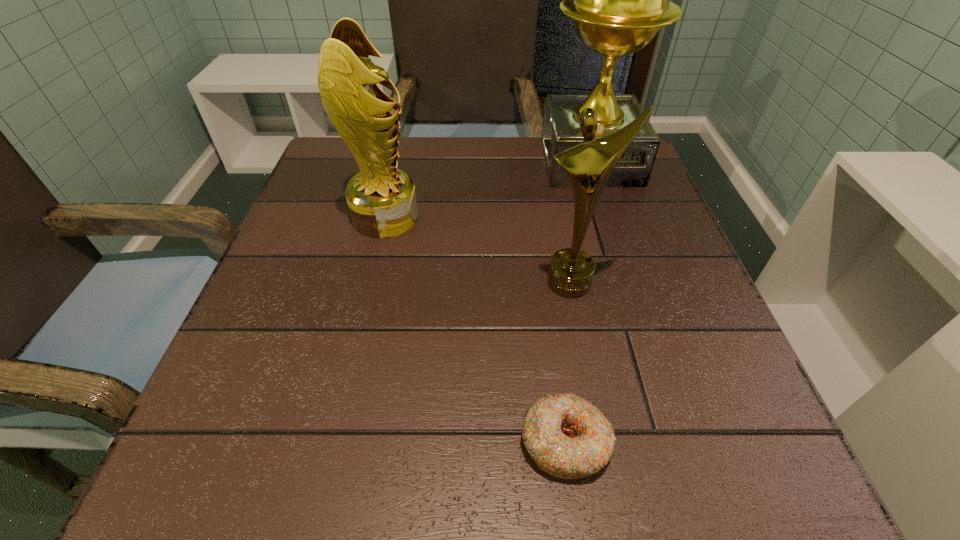
The image size is (960, 540). In the image, there is a desktop. Identify the location of vacant area at the right edge. (637, 222).

This screenshot has width=960, height=540. In the image, there is a desktop. What are the coordinates of `vacant region at the near left corner` in the screenshot? It's located at (190, 466).

Find the location of `vacant area that lies between the second farthest award and the nearest object`. vacant area that lies between the second farthest award and the nearest object is located at coordinates (475, 329).

At what (x,y) coordinates should I click in order to perform the action: click on free space between the leftmost award and the nearest award. Please return your answer as a coordinate pair (x, y). Looking at the image, I should click on (478, 250).

Locate an element on the screen. Image resolution: width=960 pixels, height=540 pixels. empty space between the leftmost award and the nearest object is located at coordinates (475, 329).

Locate an element on the screen. vacant area that lies between the leftmost award and the nearest award is located at coordinates (478, 250).

You are a GUI agent. You are given a task and a screenshot of the screen. Output one action in this format:
    pyautogui.click(x=<x>, y=<y>)
    Task: Click on the free area in between the doughnut and the leftmost object
    The height and width of the screenshot is (540, 960).
    Given the screenshot: What is the action you would take?
    pyautogui.click(x=475, y=329)

The image size is (960, 540). I want to click on free spot between the second farthest award and the shortest object, so 475,329.

Locate an element on the screen. This screenshot has width=960, height=540. unoccupied area between the shortest object and the farthest object is located at coordinates (577, 301).

Find the location of a particular element. This screenshot has width=960, height=540. free area in between the leftmost award and the farthest award is located at coordinates (488, 190).